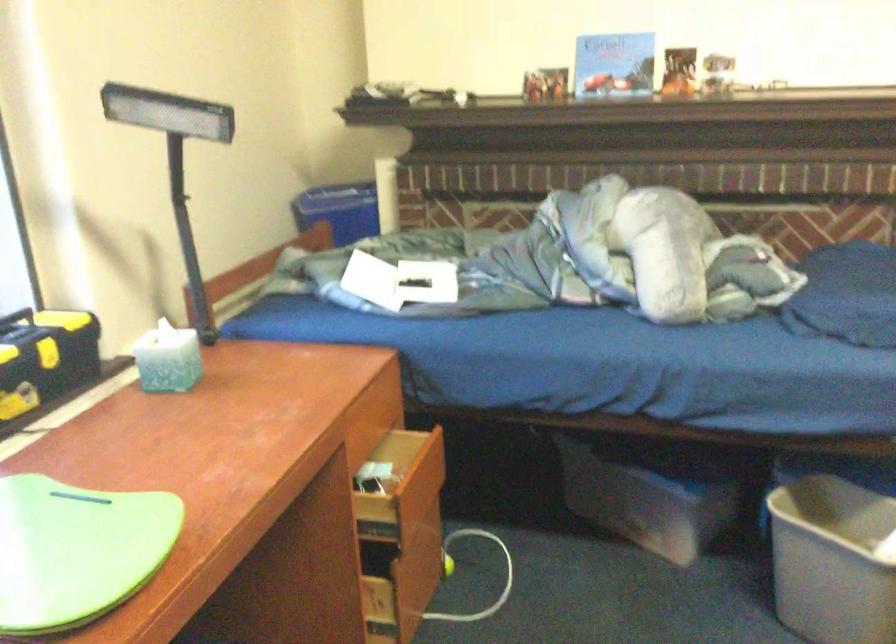
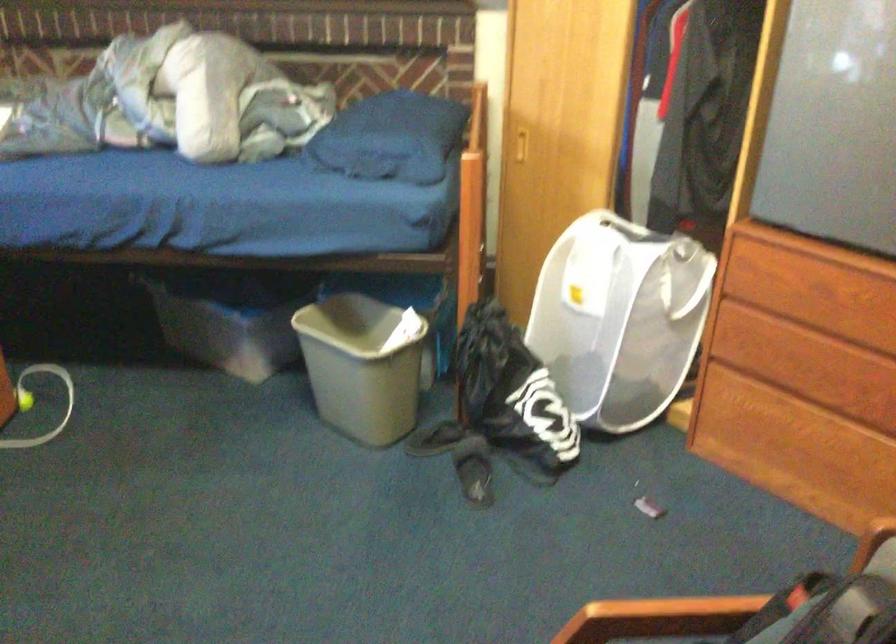
Question: The camera is either moving clockwise (left) or counter-clockwise (right) around the object. The first image is from the beginning of the video and the second image is from the end. Is the camera moving left or right when shooting the video?

Choices:
 (A) Left
 (B) Right

Answer: (A)